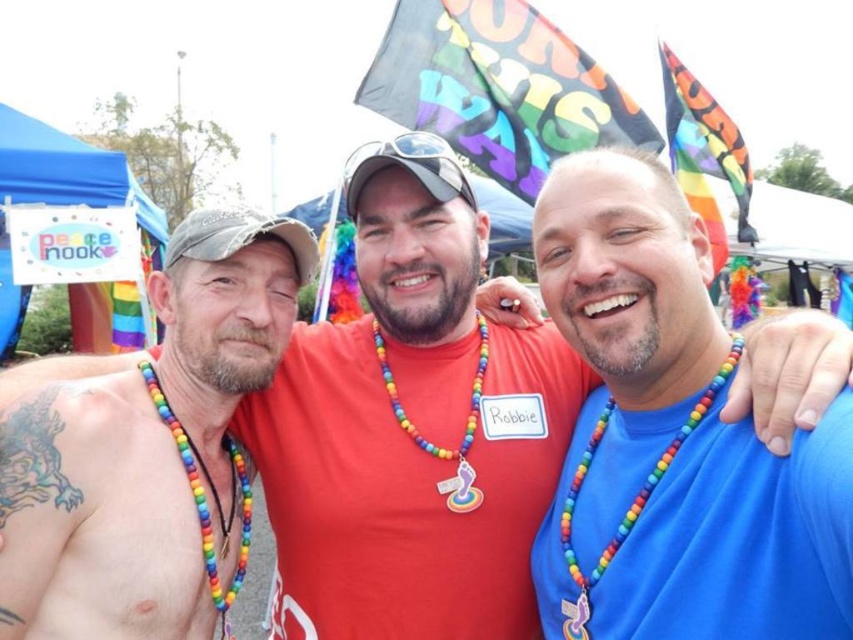
Can you confirm if blue skin at upper left is positioned to the left of rainbow beaded necklace at left?

Yes, blue skin at upper left is to the left of rainbow beaded necklace at left.

Does blue skin at upper left appear under rainbow beaded necklace at left?

Actually, blue skin at upper left is above rainbow beaded necklace at left.

Locate an element on the screen. blue skin at upper left is located at coordinates (114, 513).

Is blue matte shirt at center below blue skin at upper left?

No, blue matte shirt at center is not below blue skin at upper left.

Is blue matte shirt at center smaller than blue skin at upper left?

No, blue matte shirt at center is not smaller than blue skin at upper left.

Is point (682, 342) in front of point (32, 493)?

No.

The image size is (853, 640). Identify the location of blue matte shirt at center. (674, 436).

Between blue skin at upper left and rainbow beads necklace at center, which one has less height?

With less height is blue skin at upper left.

Does blue skin at upper left have a smaller size compared to rainbow beads necklace at center?

No.

Between point (3, 605) and point (664, 461), which one is positioned behind?

The point (664, 461) is behind.

At what (x,y) coordinates should I click in order to perform the action: click on blue skin at upper left. Please return your answer as a coordinate pair (x, y). The image size is (853, 640). Looking at the image, I should click on (114, 513).